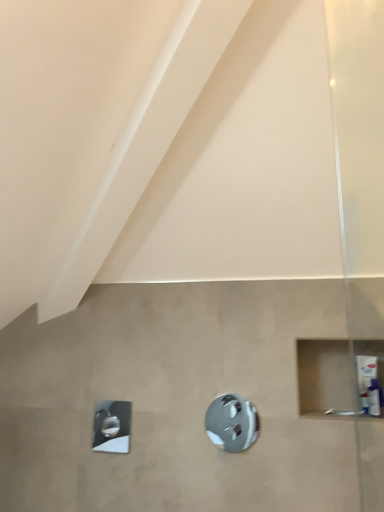
Question: From a real-world perspective, is polished chrome showerhead at lower left, the 2th shower from the front, physically above white plastic tube at right?

Choices:
 (A) yes
 (B) no

Answer: (B)

Question: Considering the relative sizes of polished chrome showerhead at lower left, the first shower positioned from the left, and white plastic tube at right in the image provided, is polished chrome showerhead at lower left, the first shower positioned from the left, shorter than white plastic tube at right?

Choices:
 (A) no
 (B) yes

Answer: (A)

Question: Can you see polished chrome showerhead at lower left, the first shower positioned from the left, touching white plastic tube at right?

Choices:
 (A) yes
 (B) no

Answer: (B)

Question: From the image's perspective, is polished chrome showerhead at lower left, which appears as the second shower when viewed from the right, below white plastic tube at right?

Choices:
 (A) yes
 (B) no

Answer: (A)

Question: Is white plastic tube at right inside polished chrome showerhead at lower left, the first shower positioned from the left?

Choices:
 (A) yes
 (B) no

Answer: (B)

Question: Does polished chrome showerhead at lower left, the first shower from the back, have a greater width compared to white plastic tube at right?

Choices:
 (A) no
 (B) yes

Answer: (A)

Question: Is polished chrome showerhead at lower left, the first shower from the back, shorter than polished chrome shower at center, placed as the 1th shower when sorted from front to back?

Choices:
 (A) no
 (B) yes

Answer: (B)

Question: Is the position of polished chrome showerhead at lower left, the first shower from the back, more distant than that of polished chrome shower at center, which is counted as the second shower, starting from the left?

Choices:
 (A) no
 (B) yes

Answer: (B)

Question: Can you confirm if polished chrome showerhead at lower left, the first shower from the back, is wider than polished chrome shower at center, which is counted as the second shower, starting from the left?

Choices:
 (A) yes
 (B) no

Answer: (A)

Question: Is polished chrome shower at center, the 1th shower viewed from the right, completely or partially inside polished chrome showerhead at lower left, which appears as the second shower when viewed from the right?

Choices:
 (A) no
 (B) yes

Answer: (A)

Question: Can you confirm if polished chrome showerhead at lower left, the first shower from the back, is bigger than polished chrome shower at center, placed as the 1th shower when sorted from front to back?

Choices:
 (A) yes
 (B) no

Answer: (A)

Question: From the image's perspective, is polished chrome showerhead at lower left, which appears as the second shower when viewed from the right, on polished chrome shower at center, placed as the 1th shower when sorted from front to back?

Choices:
 (A) no
 (B) yes

Answer: (A)

Question: Is polished chrome shower at center, the 1th shower viewed from the right, positioned in front of white plastic tube at right?

Choices:
 (A) yes
 (B) no

Answer: (B)